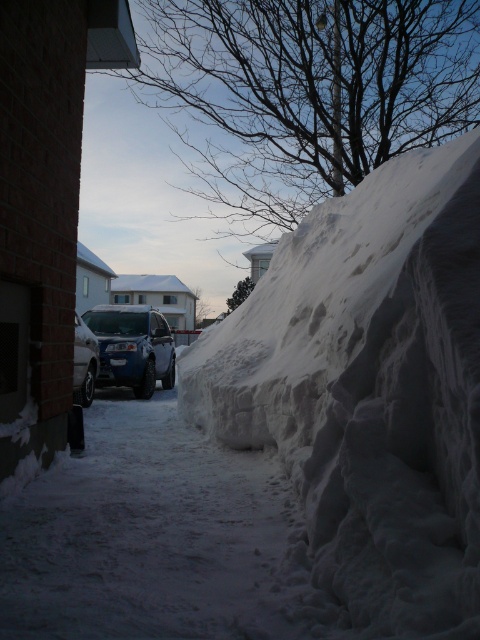
Question: Among these points, which one is farthest from the camera?

Choices:
 (A) (152, 380)
 (B) (406, 209)

Answer: (A)

Question: Is satin blue sedan at center above silver metallic car at center?

Choices:
 (A) yes
 (B) no

Answer: (B)

Question: Which object is closer to the camera taking this photo?

Choices:
 (A) satin blue sedan at center
 (B) silver metallic car at center
 (C) white fluffy snow at right

Answer: (C)

Question: Can you confirm if satin blue sedan at center is positioned to the left of silver metallic car at center?

Choices:
 (A) no
 (B) yes

Answer: (A)

Question: Observing the image, what is the correct spatial positioning of satin blue sedan at center in reference to silver metallic car at center?

Choices:
 (A) above
 (B) below

Answer: (B)

Question: Which object is the closest to the silver metallic car at center?

Choices:
 (A) satin blue sedan at center
 (B) white fluffy snow at right

Answer: (A)